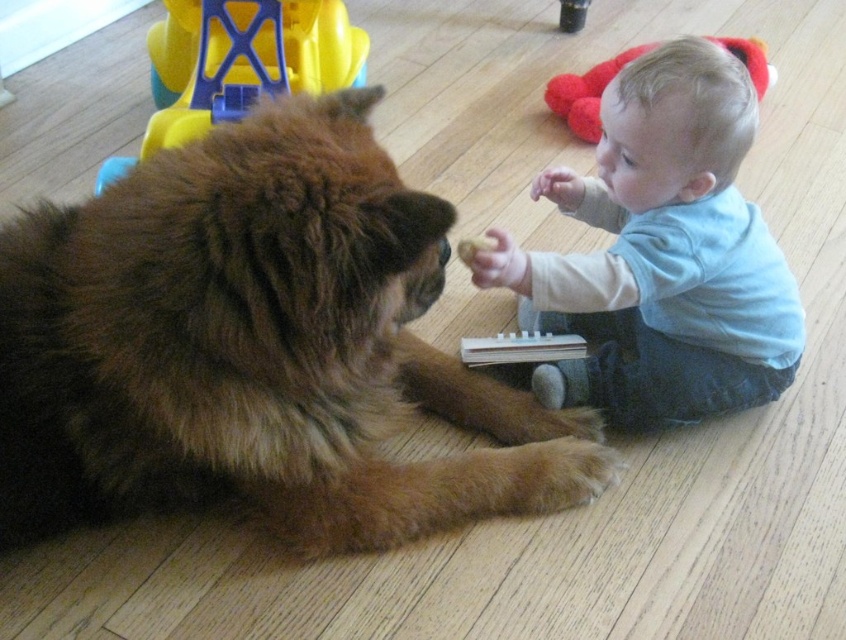
Between point (69, 339) and point (460, 240), which one is positioned behind?

The point (460, 240) is more distant.

Is brown fluffy dog at center above yellow crumbly food at center?

Actually, brown fluffy dog at center is below yellow crumbly food at center.

Which is in front, point (62, 500) or point (476, 248)?

Point (62, 500) is more forward.

Locate an element on the screen. brown fluffy dog at center is located at coordinates (256, 346).

From the picture: Is the position of yellow plastic toy at upper left less distant than that of yellow crumbly food at center?

No, it is behind yellow crumbly food at center.

Who is more distant from viewer, [180,4] or [470,246]?

The point [180,4] is more distant.

Where is `yellow plastic toy at upper left`? Image resolution: width=846 pixels, height=640 pixels. yellow plastic toy at upper left is located at coordinates (250, 64).

Does fuzzy fabric plush at upper right have a lesser height compared to yellow crumbly food at center?

In fact, fuzzy fabric plush at upper right may be taller than yellow crumbly food at center.

Who is more distant from viewer, (592, 65) or (493, 241)?

The point (592, 65) is more distant.

Is point (627, 58) in front of point (465, 253)?

No, it is not.

Find the location of a particular element. The image size is (846, 640). fuzzy fabric plush at upper right is located at coordinates (586, 93).